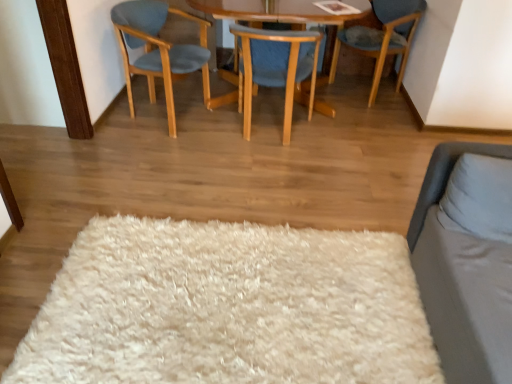
Find the location of `blue fabric chair at upper right, which is counted as the first chair, starting from the right`. blue fabric chair at upper right, which is counted as the first chair, starting from the right is located at coordinates tap(382, 37).

What do you see at coordinates (479, 197) in the screenshot?
I see `gray soft pillow at right` at bounding box center [479, 197].

Describe the element at coordinates (158, 50) in the screenshot. Image resolution: width=512 pixels, height=384 pixels. I see `light blue fabric chair at left, marked as the 1th chair in a left-to-right arrangement` at that location.

I want to click on light blue fabric chair at left, which is the 3th chair from right to left, so click(x=158, y=50).

This screenshot has width=512, height=384. I want to click on wooden chair at center, marked as the second chair in a left-to-right arrangement, so tap(275, 67).

Is gray soft pillow at right bigger than wooden chair at center, marked as the second chair in a left-to-right arrangement?

Incorrect, gray soft pillow at right is not larger than wooden chair at center, marked as the second chair in a left-to-right arrangement.

Considering the sizes of objects gray soft pillow at right and wooden chair at center, which ranks as the 2th chair in right-to-left order, in the image provided, who is thinner, gray soft pillow at right or wooden chair at center, which ranks as the 2th chair in right-to-left order,?

Thinner between the two is gray soft pillow at right.

Is gray soft pillow at right not near wooden chair at center, which ranks as the 2th chair in right-to-left order?

gray soft pillow at right is positioned a significant distance from wooden chair at center, which ranks as the 2th chair in right-to-left order.

Between point (459, 200) and point (241, 26), which one is positioned in front?

Point (459, 200)

The width and height of the screenshot is (512, 384). I want to click on the 1st chair to the right of the light blue fabric chair at left, which is the 3th chair from right to left, counting from the anchor's position, so (x=275, y=67).

Which is less distant, (156, 9) or (291, 58)?

Clearly, point (156, 9) is more distant from the camera than point (291, 58).

In the scene shown: Is light blue fabric chair at left, which is the 3th chair from right to left, spatially inside wooden chair at center, marked as the second chair in a left-to-right arrangement, or outside of it?

light blue fabric chair at left, which is the 3th chair from right to left, is not enclosed by wooden chair at center, marked as the second chair in a left-to-right arrangement.

Is light blue fabric chair at left, which is the 3th chair from right to left, facing towards wooden chair at center, marked as the second chair in a left-to-right arrangement?

Yes, light blue fabric chair at left, which is the 3th chair from right to left, is facing wooden chair at center, marked as the second chair in a left-to-right arrangement.

Is light blue fabric chair at left, which is the 3th chair from right to left, to the right of white fluffy rug at center from the viewer's perspective?

No.

Does light blue fabric chair at left, marked as the 1th chair in a left-to-right arrangement, turn towards white fluffy rug at center?

No, light blue fabric chair at left, marked as the 1th chair in a left-to-right arrangement, is not oriented towards white fluffy rug at center.

From the image's perspective, is gray soft pillow at right located above or below light blue fabric chair at left, which is the 3th chair from right to left?

gray soft pillow at right is below light blue fabric chair at left, which is the 3th chair from right to left.

Does gray soft pillow at right turn towards light blue fabric chair at left, which is the 3th chair from right to left?

No, gray soft pillow at right is not turned towards light blue fabric chair at left, which is the 3th chair from right to left.

Is gray soft pillow at right smaller than light blue fabric chair at left, marked as the 1th chair in a left-to-right arrangement?

Yes.

Is gray soft pillow at right in front of or behind light blue fabric chair at left, which is the 3th chair from right to left, in the image?

gray soft pillow at right is in front of light blue fabric chair at left, which is the 3th chair from right to left.

Considering the sizes of wooden chair at center, marked as the second chair in a left-to-right arrangement, and white fluffy rug at center in the image, is wooden chair at center, marked as the second chair in a left-to-right arrangement, bigger or smaller than white fluffy rug at center?

In the image, wooden chair at center, marked as the second chair in a left-to-right arrangement, appears to be larger than white fluffy rug at center.

Would you consider wooden chair at center, marked as the second chair in a left-to-right arrangement, to be distant from white fluffy rug at center?

wooden chair at center, marked as the second chair in a left-to-right arrangement, is far away from white fluffy rug at center.

From the image's perspective, which one is positioned lower, wooden chair at center, which ranks as the 2th chair in right-to-left order, or white fluffy rug at center?

white fluffy rug at center is shown below in the image.

Does point (243, 130) come closer to viewer compared to point (310, 280)?

No, it is not.

Looking at this image, is blue fabric chair at upper right, which is counted as the first chair, starting from the right, smaller than white fluffy rug at center?

No, blue fabric chair at upper right, which is counted as the first chair, starting from the right, is not smaller than white fluffy rug at center.

From a real-world perspective, which object rests below the other?

From a 3D spatial view, white fluffy rug at center is below.

Considering the sizes of objects blue fabric chair at upper right, the third chair positioned from the left, and white fluffy rug at center in the image provided, who is taller, blue fabric chair at upper right, the third chair positioned from the left, or white fluffy rug at center?

With more height is blue fabric chair at upper right, the third chair positioned from the left.

Is blue fabric chair at upper right, the third chair positioned from the left, beside white fluffy rug at center?

No, blue fabric chair at upper right, the third chair positioned from the left, is not touching white fluffy rug at center.

Is light blue fabric chair at left, marked as the 1th chair in a left-to-right arrangement, not near gray soft pillow at right?

That's right, there is a large distance between light blue fabric chair at left, marked as the 1th chair in a left-to-right arrangement, and gray soft pillow at right.

Is light blue fabric chair at left, which is the 3th chair from right to left, wider than gray soft pillow at right?

Indeed, light blue fabric chair at left, which is the 3th chair from right to left, has a greater width compared to gray soft pillow at right.

You are a GUI agent. You are given a task and a screenshot of the screen. Output one action in this format:
    pyautogui.click(x=<x>, y=<y>)
    Task: Click on the 2nd chair to the left of the gray soft pillow at right, counting from the anchor's position
    Image resolution: width=512 pixels, height=384 pixels.
    Given the screenshot: What is the action you would take?
    pyautogui.click(x=158, y=50)

From a real-world perspective, is light blue fabric chair at left, which is the 3th chair from right to left, above or below gray soft pillow at right?

Clearly, from a real-world perspective, light blue fabric chair at left, which is the 3th chair from right to left, is below gray soft pillow at right.

Locate an element on the screen. The image size is (512, 384). chair that is the 2nd object directly below the gray soft pillow at right (from a real-world perspective) is located at coordinates (275, 67).

Locate an element on the screen. This screenshot has height=384, width=512. chair that appears below the light blue fabric chair at left, which is the 3th chair from right to left (from the image's perspective) is located at coordinates (275, 67).

Considering their positions, is white fluffy rug at center positioned further to blue fabric chair at upper right, which is counted as the first chair, starting from the right, than gray soft pillow at right?

Among the two, white fluffy rug at center is located further to blue fabric chair at upper right, which is counted as the first chair, starting from the right.

Which object lies further to the anchor point gray soft pillow at right, white fluffy rug at center or light blue fabric chair at left, marked as the 1th chair in a left-to-right arrangement?

light blue fabric chair at left, marked as the 1th chair in a left-to-right arrangement, is further to gray soft pillow at right.

Based on their spatial positions, is gray soft pillow at right or white fluffy rug at center further from blue fabric chair at upper right, which is counted as the first chair, starting from the right?

white fluffy rug at center.

Based on their spatial positions, is blue fabric chair at upper right, which is counted as the first chair, starting from the right, or light blue fabric chair at left, marked as the 1th chair in a left-to-right arrangement, further from white fluffy rug at center?

Based on the image, blue fabric chair at upper right, which is counted as the first chair, starting from the right, appears to be further to white fluffy rug at center.

When comparing their distances from wooden chair at center, marked as the second chair in a left-to-right arrangement, does gray soft pillow at right or white fluffy rug at center seem closer?

Based on the image, white fluffy rug at center appears to be nearer to wooden chair at center, marked as the second chair in a left-to-right arrangement.

Considering their positions, is blue fabric chair at upper right, which is counted as the first chair, starting from the right, positioned further to gray soft pillow at right than wooden chair at center, marked as the second chair in a left-to-right arrangement?

The object further to gray soft pillow at right is blue fabric chair at upper right, which is counted as the first chair, starting from the right.

When comparing their distances from light blue fabric chair at left, marked as the 1th chair in a left-to-right arrangement, does wooden chair at center, which ranks as the 2th chair in right-to-left order, or gray soft pillow at right seem further?

gray soft pillow at right.

Considering their positions, is wooden chair at center, which ranks as the 2th chair in right-to-left order, positioned further to blue fabric chair at upper right, which is counted as the first chair, starting from the right, than gray soft pillow at right?

gray soft pillow at right.

The width and height of the screenshot is (512, 384). In order to click on pillow between wooden chair at center, which ranks as the 2th chair in right-to-left order, and white fluffy rug at center from top to bottom in this screenshot , I will do `click(479, 197)`.

This screenshot has height=384, width=512. Identify the location of pillow between white fluffy rug at center and blue fabric chair at upper right, which is counted as the first chair, starting from the right, from front to back. (479, 197).

I want to click on chair between light blue fabric chair at left, which is the 3th chair from right to left, and white fluffy rug at center in the up-down direction, so click(x=275, y=67).

Image resolution: width=512 pixels, height=384 pixels. Find the location of `chair located between light blue fabric chair at left, marked as the 1th chair in a left-to-right arrangement, and blue fabric chair at upper right, which is counted as the first chair, starting from the right, in the left-right direction`. chair located between light blue fabric chair at left, marked as the 1th chair in a left-to-right arrangement, and blue fabric chair at upper right, which is counted as the first chair, starting from the right, in the left-right direction is located at coordinates (275, 67).